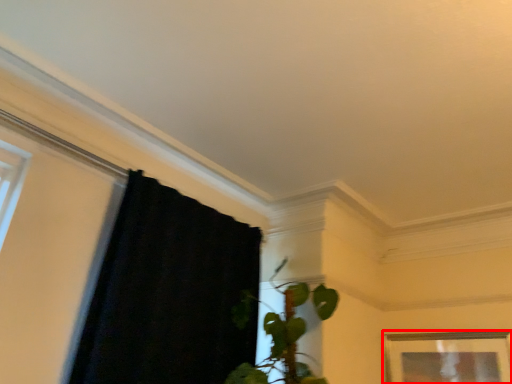
Question: From the image, what is the correct spatial relationship of picture frame (annotated by the red box) in relation to curtain?

Choices:
 (A) left
 (B) right

Answer: (B)